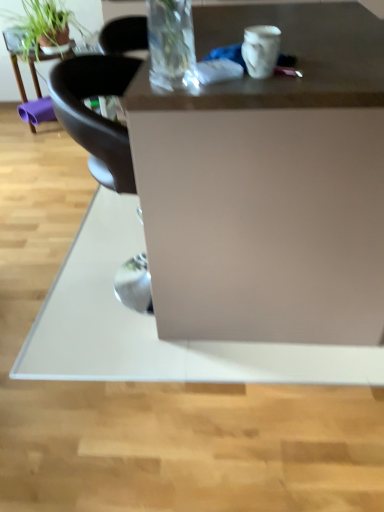
Locate an element on the screen. The width and height of the screenshot is (384, 512). free spot to the left of matte black table at upper left is located at coordinates (11, 129).